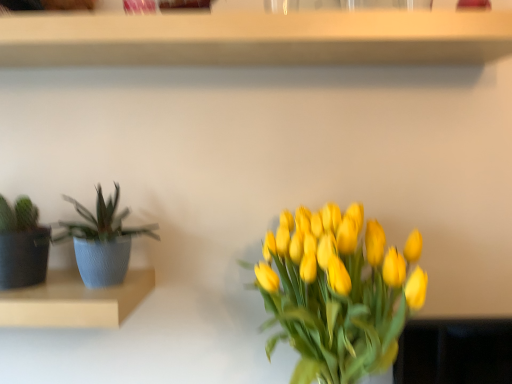
Question: Considering the relative sizes of blue textured pot at left and wooden shelf at upper center, which ranks as the 1th shelf in top-to-bottom order, in the image provided, is blue textured pot at left wider than wooden shelf at upper center, which ranks as the 1th shelf in top-to-bottom order,?

Choices:
 (A) yes
 (B) no

Answer: (B)

Question: From a real-world perspective, is blue textured pot at left below wooden shelf at upper center, which ranks as the 1th shelf in top-to-bottom order?

Choices:
 (A) no
 (B) yes

Answer: (B)

Question: Is the surface of blue textured pot at left in direct contact with wooden shelf at upper center, which ranks as the 1th shelf in top-to-bottom order?

Choices:
 (A) yes
 (B) no

Answer: (B)

Question: From a real-world perspective, is blue textured pot at left located higher than wooden shelf at upper center, positioned as the second shelf in bottom-to-top order?

Choices:
 (A) yes
 (B) no

Answer: (B)

Question: Does blue textured pot at left appear on the left side of wooden shelf at upper center, positioned as the second shelf in bottom-to-top order?

Choices:
 (A) no
 (B) yes

Answer: (B)

Question: Choose the correct answer: Is wooden shelf at upper center, which ranks as the 1th shelf in top-to-bottom order, inside matte blue pot at left, placed as the 2th shelf when sorted from top to bottom, or outside it?

Choices:
 (A) inside
 (B) outside

Answer: (B)

Question: From their relative heights in the image, would you say wooden shelf at upper center, which ranks as the 1th shelf in top-to-bottom order, is taller or shorter than matte blue pot at left, placed as the 2th shelf when sorted from top to bottom?

Choices:
 (A) short
 (B) tall

Answer: (A)

Question: From a real-world perspective, is wooden shelf at upper center, which ranks as the 1th shelf in top-to-bottom order, positioned above or below matte blue pot at left, placed as the 2th shelf when sorted from top to bottom?

Choices:
 (A) above
 (B) below

Answer: (A)

Question: Is wooden shelf at upper center, which ranks as the 1th shelf in top-to-bottom order, in front of or behind matte blue pot at left, placed as the 2th shelf when sorted from top to bottom, in the image?

Choices:
 (A) front
 (B) behind

Answer: (A)

Question: Would you say matte blue pot at left, which ranks as the 1th shelf in bottom-to-top order, is to the left or to the right of blue textured pot at left in the picture?

Choices:
 (A) right
 (B) left

Answer: (B)

Question: Is matte blue pot at left, which ranks as the 1th shelf in bottom-to-top order, spatially inside blue textured pot at left, or outside of it?

Choices:
 (A) inside
 (B) outside

Answer: (B)

Question: From the image's perspective, relative to blue textured pot at left, is matte blue pot at left, which ranks as the 1th shelf in bottom-to-top order, above or below?

Choices:
 (A) above
 (B) below

Answer: (B)

Question: From a real-world perspective, is matte blue pot at left, which ranks as the 1th shelf in bottom-to-top order, physically located above or below blue textured pot at left?

Choices:
 (A) above
 (B) below

Answer: (B)

Question: Considering the positions of point click(x=90, y=309) and point click(x=331, y=18), is point click(x=90, y=309) closer or farther from the camera than point click(x=331, y=18)?

Choices:
 (A) farther
 (B) closer

Answer: (B)

Question: Which is correct: matte blue pot at left, which ranks as the 1th shelf in bottom-to-top order, is inside wooden shelf at upper center, which ranks as the 1th shelf in top-to-bottom order, or outside of it?

Choices:
 (A) outside
 (B) inside

Answer: (A)